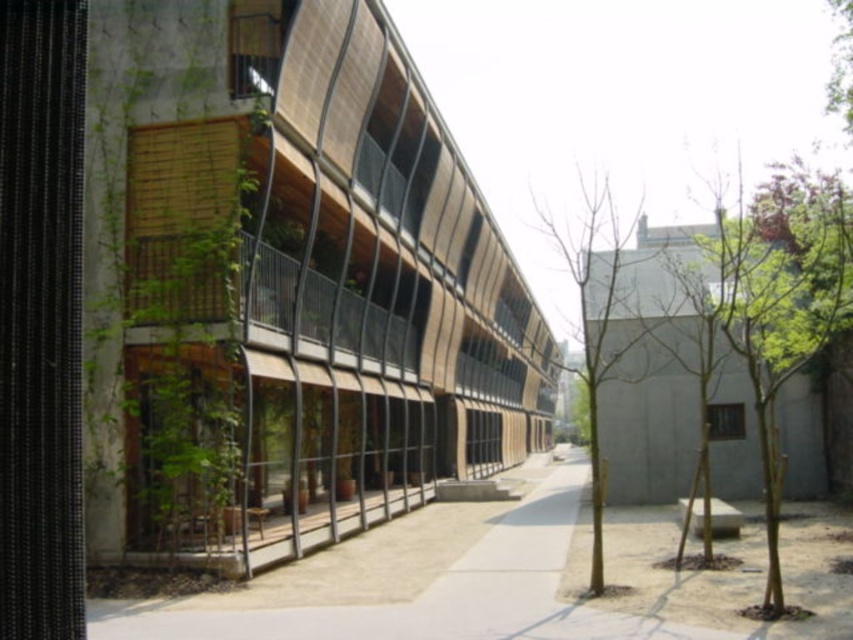
From the picture: Can you confirm if green leafy tree at center right is positioned above green leafy tree at center?

Yes.

Is green leafy tree at center right thinner than green leafy tree at center?

No, green leafy tree at center right is not thinner than green leafy tree at center.

Locate an element on the screen. The width and height of the screenshot is (853, 640). green leafy tree at center right is located at coordinates (781, 305).

Image resolution: width=853 pixels, height=640 pixels. I want to click on green leafy tree at center right, so click(x=781, y=305).

This screenshot has width=853, height=640. I want to click on smooth concrete pavement at center, so click(515, 577).

Who is positioned more to the right, smooth concrete pavement at center or green leafy tree at center?

green leafy tree at center

Describe the element at coordinates (515, 577) in the screenshot. This screenshot has height=640, width=853. I see `smooth concrete pavement at center` at that location.

Locate an element on the screen. smooth concrete pavement at center is located at coordinates (515, 577).

Is smooth concrete pavement at center thinner than green leafy tree at center right?

Indeed, smooth concrete pavement at center has a lesser width compared to green leafy tree at center right.

Between smooth concrete pavement at center and green leafy tree at center right, which one has less height?

With less height is smooth concrete pavement at center.

Is point (763, 532) positioned in front of point (772, 342)?

That is False.

I want to click on smooth concrete pavement at center, so click(x=515, y=577).